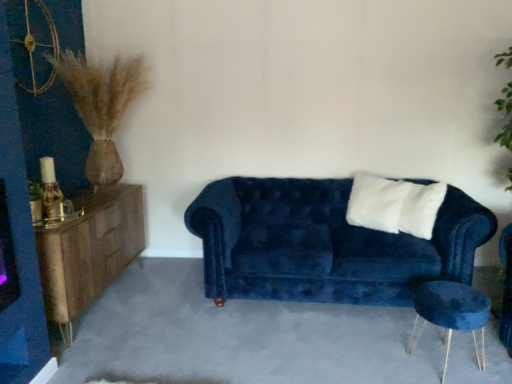
Question: Considering the relative sizes of velvet blue couch at center and woodenmaterial/texturedresser at left in the image provided, is velvet blue couch at center taller than woodenmaterial/texturedresser at left?

Choices:
 (A) no
 (B) yes

Answer: (B)

Question: Considering the relative positions of velvet blue couch at center and woodenmaterial/texturedresser at left in the image provided, is velvet blue couch at center to the right of woodenmaterial/texturedresser at left from the viewer's perspective?

Choices:
 (A) no
 (B) yes

Answer: (B)

Question: Is woodenmaterial/texturedresser at left surrounded by velvet blue couch at center?

Choices:
 (A) yes
 (B) no

Answer: (B)

Question: Can you confirm if velvet blue couch at center is wider than woodenmaterial/texturedresser at left?

Choices:
 (A) no
 (B) yes

Answer: (B)

Question: Can you confirm if velvet blue couch at center is positioned to the left of woodenmaterial/texturedresser at left?

Choices:
 (A) yes
 (B) no

Answer: (B)

Question: Is point (335, 299) positioned closer to the camera than point (411, 215)?

Choices:
 (A) farther
 (B) closer

Answer: (B)

Question: Which is correct: velvet blue couch at center is inside white soft pillow at center, or outside of it?

Choices:
 (A) inside
 (B) outside

Answer: (B)

Question: Relative to white soft pillow at center, is velvet blue couch at center in front or behind?

Choices:
 (A) front
 (B) behind

Answer: (A)

Question: From a real-world perspective, is velvet blue couch at center above or below white soft pillow at center?

Choices:
 (A) above
 (B) below

Answer: (B)

Question: Considering the relative positions of white soft pillow at center and woodenmaterial/texturedresser at left in the image provided, is white soft pillow at center to the left or to the right of woodenmaterial/texturedresser at left?

Choices:
 (A) left
 (B) right

Answer: (B)

Question: In terms of size, does white soft pillow at center appear bigger or smaller than woodenmaterial/texturedresser at left?

Choices:
 (A) small
 (B) big

Answer: (A)

Question: In terms of width, does white soft pillow at center look wider or thinner when compared to woodenmaterial/texturedresser at left?

Choices:
 (A) wide
 (B) thin

Answer: (B)

Question: From a real-world perspective, is white soft pillow at center physically located above or below woodenmaterial/texturedresser at left?

Choices:
 (A) above
 (B) below

Answer: (A)

Question: Considering the relative positions of velvet blue side table at lower right and velvet blue couch at center in the image provided, is velvet blue side table at lower right to the left or to the right of velvet blue couch at center?

Choices:
 (A) left
 (B) right

Answer: (B)

Question: Is velvet blue side table at lower right in front of or behind velvet blue couch at center in the image?

Choices:
 (A) front
 (B) behind

Answer: (A)